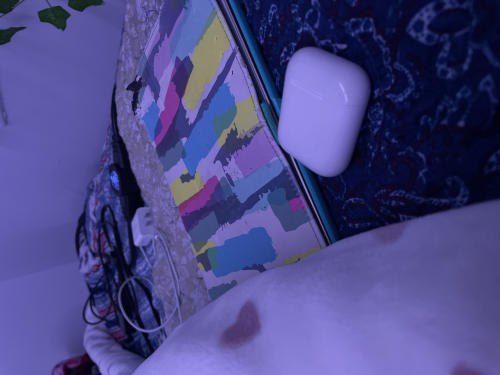
Where is `green plant leave`? This screenshot has height=375, width=500. green plant leave is located at coordinates (57, 17).